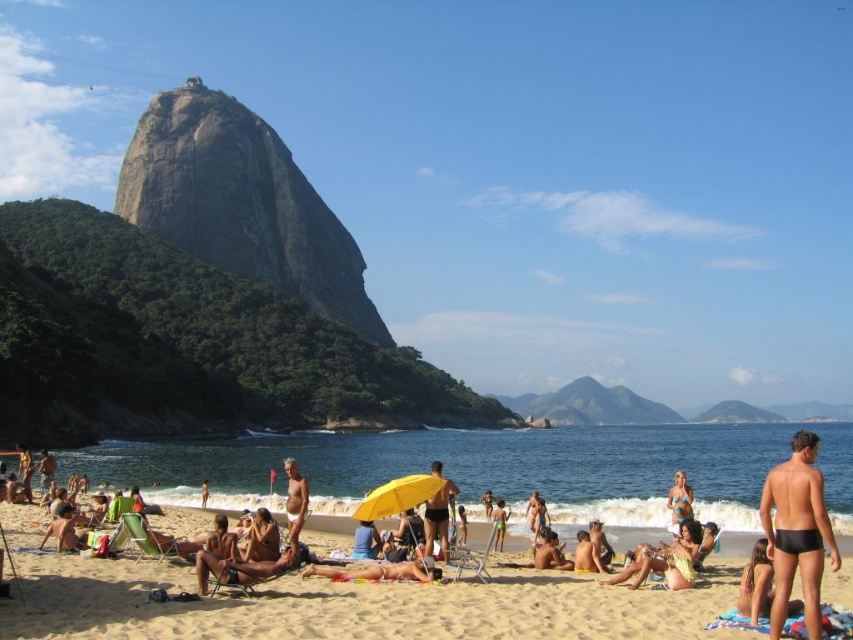
You are standing at the beach and want to take a photo of the point at coordinates (811, 548). If your camera has a maximum zoom range of 30 meters, can you capture the point clearly?

The point at coordinates (811, 548) is 28.40 meters away from the camera. Since the camera can zoom up to 30 meters, you can capture the point clearly within the maximum range.

You are a photographer trying to capture the Pedra da Gavea rock formation in the background. You want to ensure that the black matte swimsuit at right is visible in the foreground without blocking the view of the rock formation. Based on its position, can you determine if the swimsuit is positioned in a way that allows both elements to be seen clearly?

The black matte swimsuit at right is located at point (796, 531), which is towards the lower right corner of the image. Since Pedra da Gavea is in the background and the swimsuit is in the foreground but positioned near the edge, it should not obstruct the view of the rock formation. Both elements can be captured clearly in the photo.